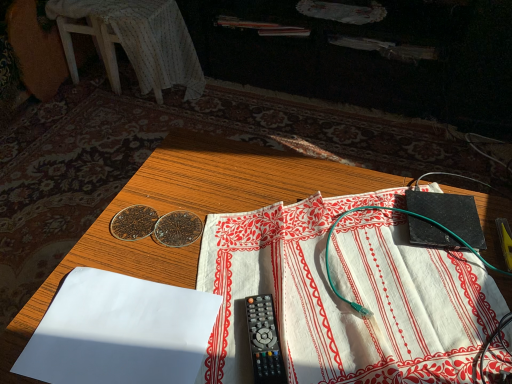
Where is `free space to the right of black plastic remote control at center`? Image resolution: width=512 pixels, height=384 pixels. free space to the right of black plastic remote control at center is located at coordinates (x=352, y=328).